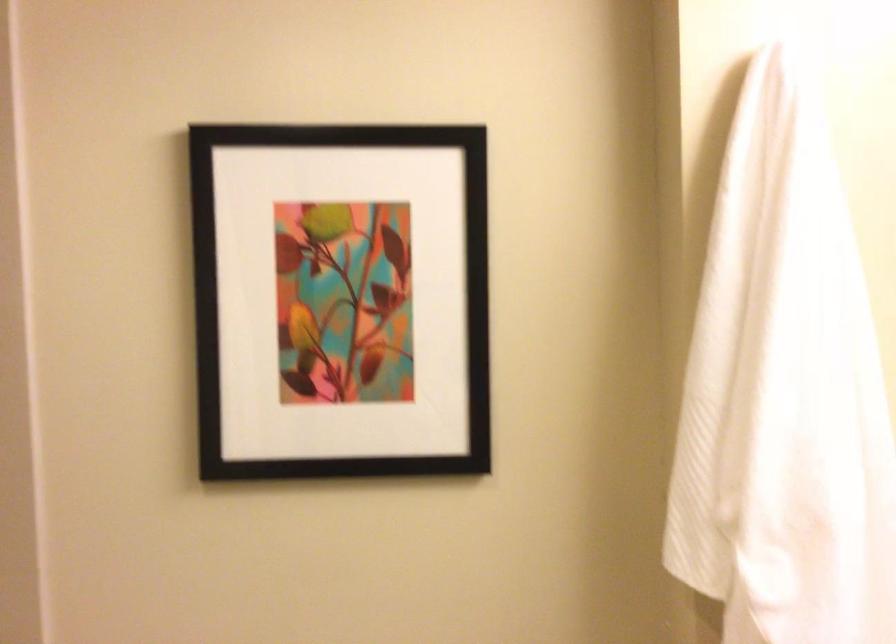
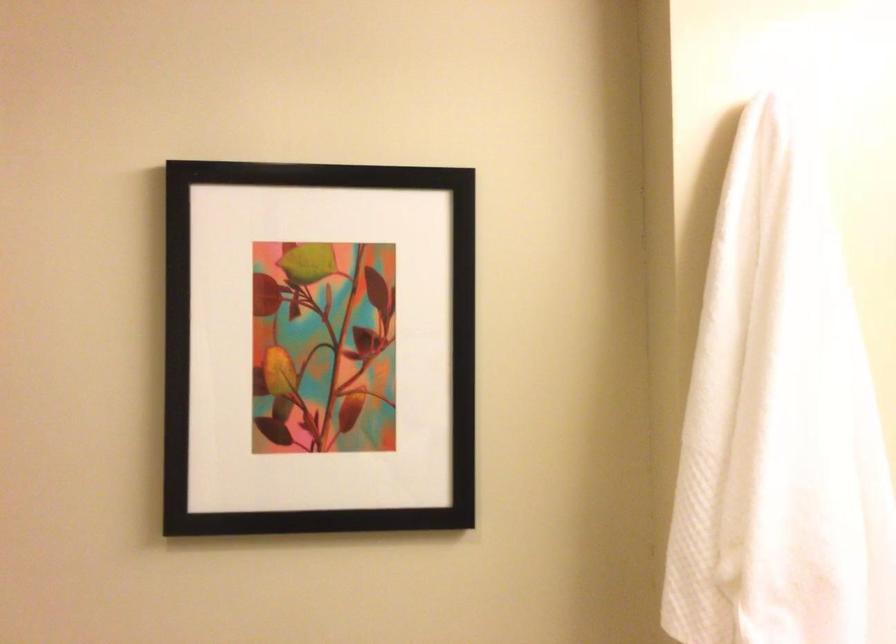
The images are taken continuously from a first-person perspective. In which direction are you moving?

The cameraman walked toward left, forward.